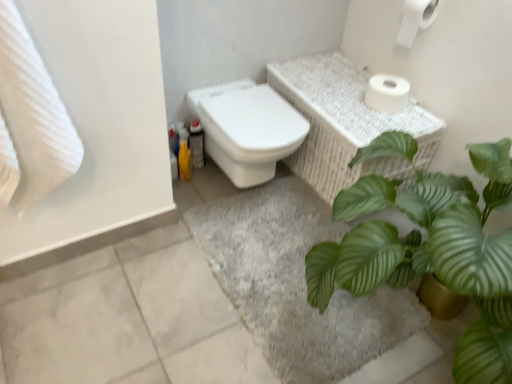
Question: Considering the positions of point (293, 334) and point (399, 102), is point (293, 334) closer or farther from the camera than point (399, 102)?

Choices:
 (A) farther
 (B) closer

Answer: (B)

Question: Is gray soft rug at lower center to the left or to the right of white matte toilet paper at upper right, the 2th toilet paper when ordered from top to bottom, in the image?

Choices:
 (A) left
 (B) right

Answer: (A)

Question: Estimate the real-world distances between objects in this image. Which object is closer to the white glossy toilet at center?

Choices:
 (A) gray soft rug at lower center
 (B) green leafy plant at center
 (C) white textured towel at left
 (D) white matte toilet paper at upper right, the second toilet paper ordered from the bottom
 (E) white wicker basket at upper right

Answer: (E)

Question: Which object is positioned closest to the green leafy plant at center?

Choices:
 (A) gray soft rug at lower center
 (B) white wicker basket at upper right
 (C) white matte toilet paper at upper right, the 2th toilet paper when ordered from top to bottom
 (D) white glossy toilet at center
 (E) white textured towel at left

Answer: (A)